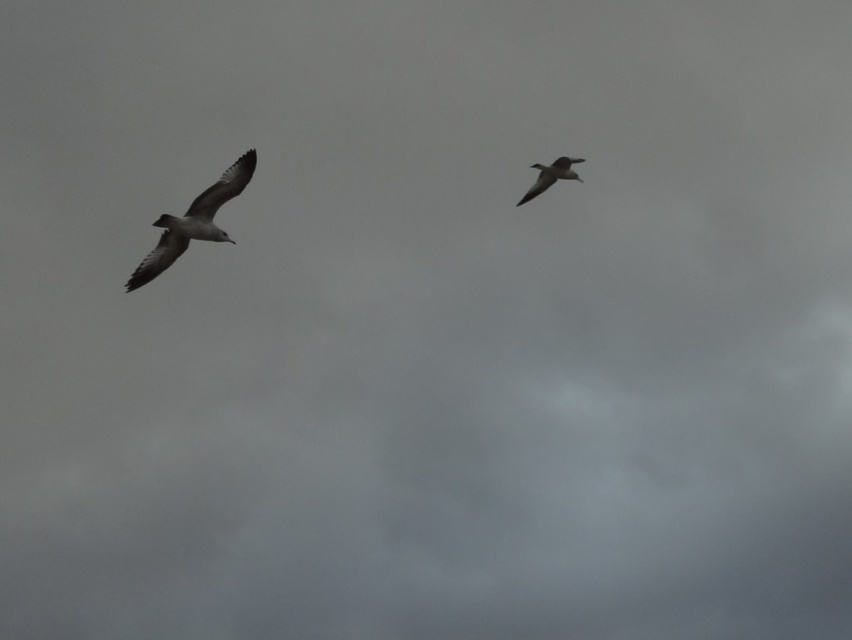
Question: Which point is closer to the camera?

Choices:
 (A) gray feathered bird at upper right
 (B) white feathered bird at left

Answer: (B)

Question: Where is white feathered bird at left located in relation to gray feathered bird at upper right in the image?

Choices:
 (A) right
 (B) left

Answer: (B)

Question: Is white feathered bird at left thinner than gray feathered bird at upper right?

Choices:
 (A) yes
 (B) no

Answer: (B)

Question: Among these objects, which one is nearest to the camera?

Choices:
 (A) gray feathered bird at upper right
 (B) white feathered bird at left

Answer: (B)

Question: Does white feathered bird at left appear on the left side of gray feathered bird at upper right?

Choices:
 (A) no
 (B) yes

Answer: (B)